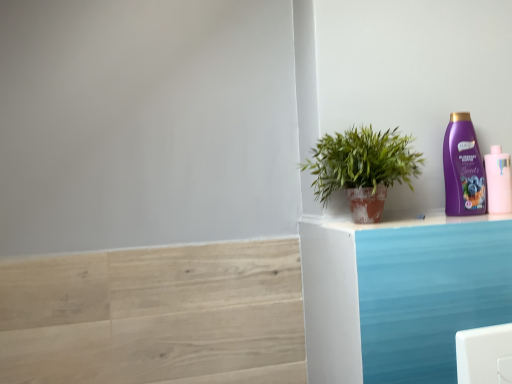
Question: Considering the relative sizes of pink matte bottle at upper right, the second bottle from the left, and light wood stair at lower left in the image provided, is pink matte bottle at upper right, the second bottle from the left, thinner than light wood stair at lower left?

Choices:
 (A) yes
 (B) no

Answer: (B)

Question: Is light wood stair at lower left completely or partially inside pink matte bottle at upper right, the first bottle viewed from the right?

Choices:
 (A) no
 (B) yes

Answer: (A)

Question: Does pink matte bottle at upper right, the second bottle from the left, have a smaller size compared to light wood stair at lower left?

Choices:
 (A) no
 (B) yes

Answer: (B)

Question: From the image's perspective, is pink matte bottle at upper right, the second bottle from the left, over light wood stair at lower left?

Choices:
 (A) yes
 (B) no

Answer: (A)

Question: Is pink matte bottle at upper right, the first bottle viewed from the right, to the left of light wood stair at lower left from the viewer's perspective?

Choices:
 (A) yes
 (B) no

Answer: (B)

Question: Is the position of pink matte bottle at upper right, the second bottle from the left, more distant than that of light wood stair at lower left?

Choices:
 (A) yes
 (B) no

Answer: (A)

Question: Is green leafy plant in terracotta pot at right positioned beyond the bounds of purple glossy shampoo bottle at upper right, marked as the second bottle in a right-to-left arrangement?

Choices:
 (A) yes
 (B) no

Answer: (A)

Question: Can you confirm if green leafy plant in terracotta pot at right is smaller than purple glossy shampoo bottle at upper right, marked as the second bottle in a right-to-left arrangement?

Choices:
 (A) yes
 (B) no

Answer: (B)

Question: Considering the relative sizes of green leafy plant in terracotta pot at right and purple glossy shampoo bottle at upper right, the 1th bottle viewed from the left, in the image provided, is green leafy plant in terracotta pot at right wider than purple glossy shampoo bottle at upper right, the 1th bottle viewed from the left,?

Choices:
 (A) no
 (B) yes

Answer: (B)

Question: Is green leafy plant in terracotta pot at right at the left side of purple glossy shampoo bottle at upper right, the 1th bottle viewed from the left?

Choices:
 (A) yes
 (B) no

Answer: (A)

Question: Is green leafy plant in terracotta pot at right surrounding purple glossy shampoo bottle at upper right, marked as the second bottle in a right-to-left arrangement?

Choices:
 (A) yes
 (B) no

Answer: (B)

Question: From the image's perspective, would you say green leafy plant in terracotta pot at right is positioned over purple glossy shampoo bottle at upper right, marked as the second bottle in a right-to-left arrangement?

Choices:
 (A) no
 (B) yes

Answer: (A)

Question: Is purple glossy shampoo bottle at upper right, the 1th bottle viewed from the left, in contact with light wood stair at lower left?

Choices:
 (A) yes
 (B) no

Answer: (B)